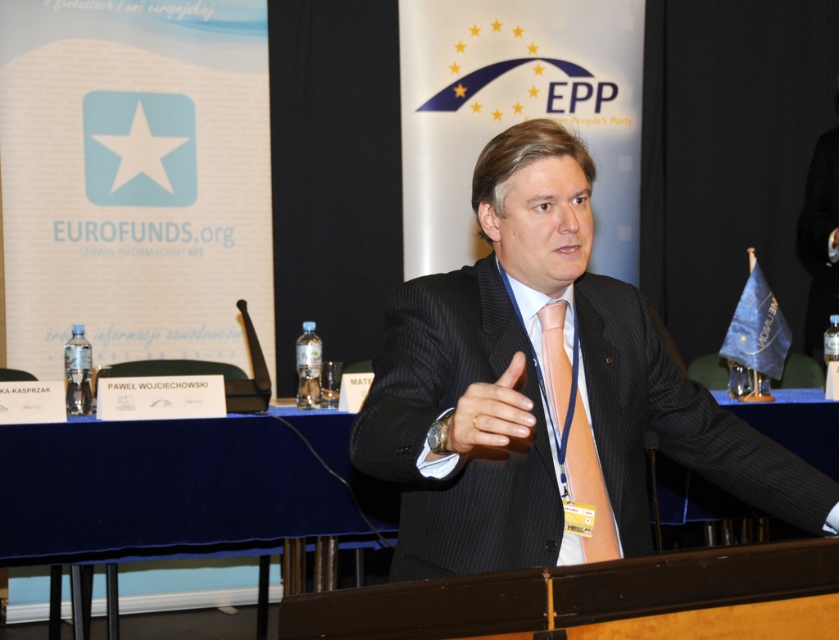
You are an event organizer who needs to place a 15 cm tall vase on the blue velvet table at center. Considering the height of the orange satin tie at center, will the vase be visible from the front row of the audience?

The blue velvet table at center has a lesser height compared to orange satin tie at center. Since the table is shorter, the 15 cm tall vase placed on it may be partially obscured by the orange satin tie at center, making it less visible from the front row.

You are attending a conference and notice two suits at the center of the stage. The speaker is wearing a dark gray suit at center and a pinstriped suit at center. Which suit is taller?

The dark gray suit at center is taller than the pinstriped suit at center.

You are an event planner observing the speaker in the image. You need to determine which part of his attire is wider between the dark gray suit at center and the pinstriped suit at center. Which one is wider?

The dark gray suit at center is wider than the pinstriped suit at center according to the description provided.